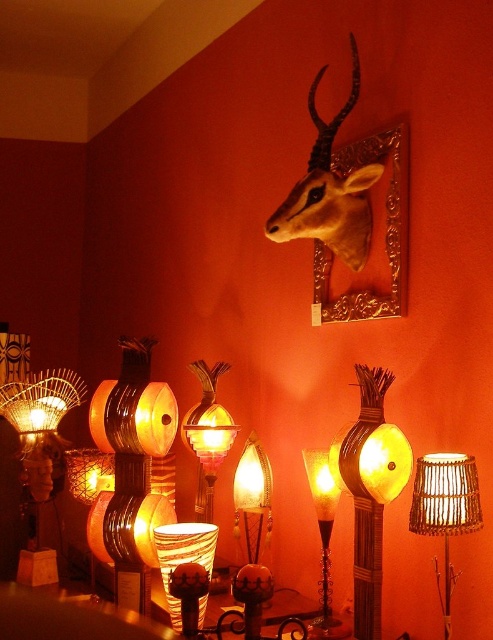
Which is in front, point (279, 212) or point (422, 513)?

Point (422, 513) is in front.

Does matte brown deer head at upper center appear over woven bamboo lampshade at center?

Yes.

Is point (352, 90) positioned after point (423, 499)?

Yes.

In order to click on matte brown deer head at upper center in this screenshot , I will do `click(329, 189)`.

Which of these two, woven bamboo lamp at center or woven bamboo lampshade at center, stands taller?

With more height is woven bamboo lamp at center.

Does point (368, 417) come behind point (429, 529)?

Yes, point (368, 417) is behind point (429, 529).

Is point (392, 444) closer to camera compared to point (439, 602)?

Yes, point (392, 444) is closer to viewer.

This screenshot has width=493, height=640. In order to click on woven bamboo lamp at center in this screenshot , I will do `click(371, 492)`.

Is woven bamboo lamp at center bigger than translucent glass lamp at center?

Indeed, woven bamboo lamp at center has a larger size compared to translucent glass lamp at center.

Who is more forward, (349, 429) or (310, 632)?

Positioned in front is point (349, 429).

This screenshot has height=640, width=493. What are the coordinates of `woven bamboo lamp at center` in the screenshot? It's located at (371, 492).